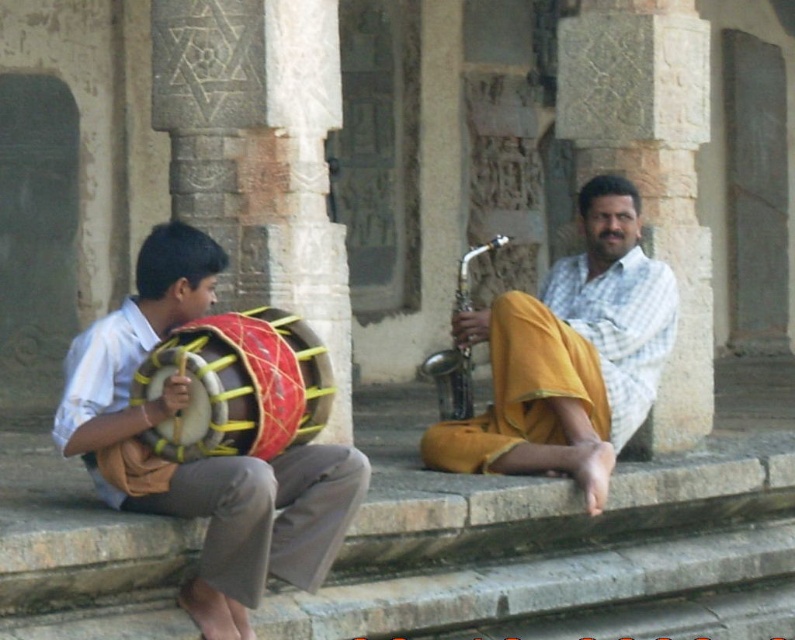
You are a photographer trying to capture a photo of the scene. You want to ensure both the matte red drum at left and the yellow cotton pants at center are visible in the frame. Based on their positions, which object should you position closer to the left side of the camera frame?

The matte red drum at left should be positioned closer to the left side of the camera frame since it is located to the left of the yellow cotton pants at center in the scene.

You are a photographer trying to capture the scene of the two musicians. You notice the matte red drum at left and the red leather drum at left. Which drum is placed higher in the image?

The matte red drum at left is positioned over the red leather drum at left, so it is placed higher in the image.

You are an architect designing a new stage for a cultural performance. The stage must accommodate both the yellow cotton pants at center and the red leather drum at left. Considering their spatial relationship, which object should be placed higher to ensure visibility for the audience?

The yellow cotton pants at center should be placed higher than the red leather drum at left because the yellow cotton pants at center has a greater height compared to red leather drum at left, ensuring better visibility for the audience.